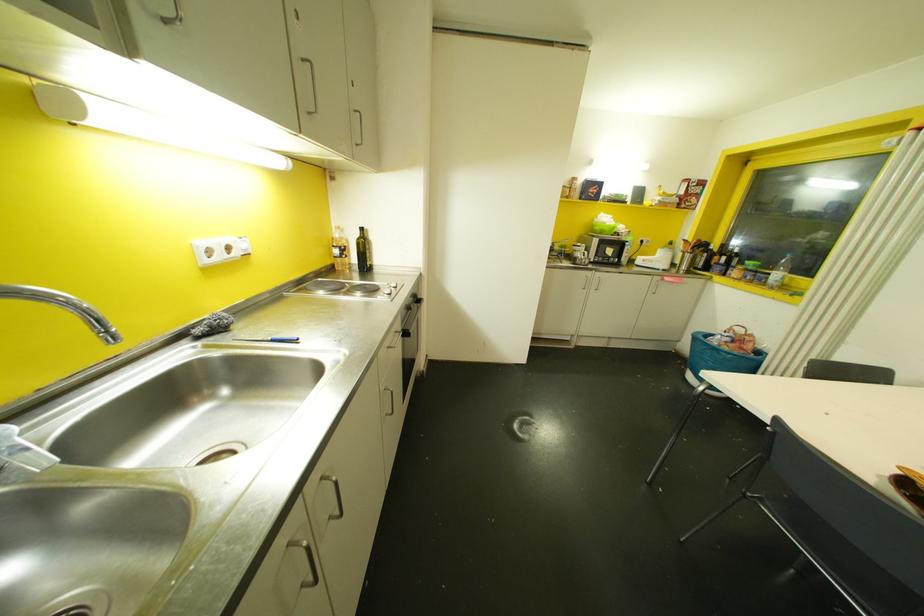
This screenshot has width=924, height=616. What are the coordinates of `plastic water bottle` in the screenshot? It's located at (779, 273).